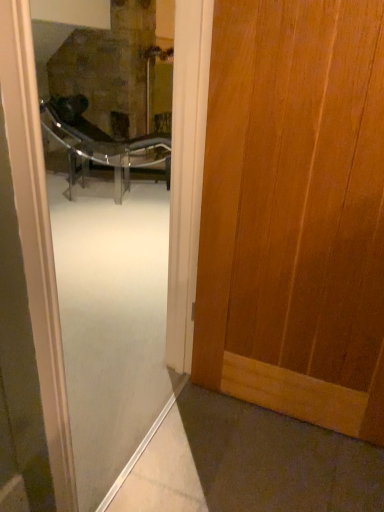
Question: In terms of width, does metallic glass chair at center look wider or thinner when compared to transparent glass screen door at center?

Choices:
 (A) wide
 (B) thin

Answer: (A)

Question: From the image's perspective, relative to transparent glass screen door at center, is metallic glass chair at center above or below?

Choices:
 (A) below
 (B) above

Answer: (B)

Question: Based on their relative distances, which object is nearer to the wooden door at right?

Choices:
 (A) metallic glass chair at center
 (B) transparent glass screen door at center

Answer: (B)

Question: Which of these objects is positioned closest to the transparent glass screen door at center?

Choices:
 (A) metallic glass chair at center
 (B) wooden door at right

Answer: (A)